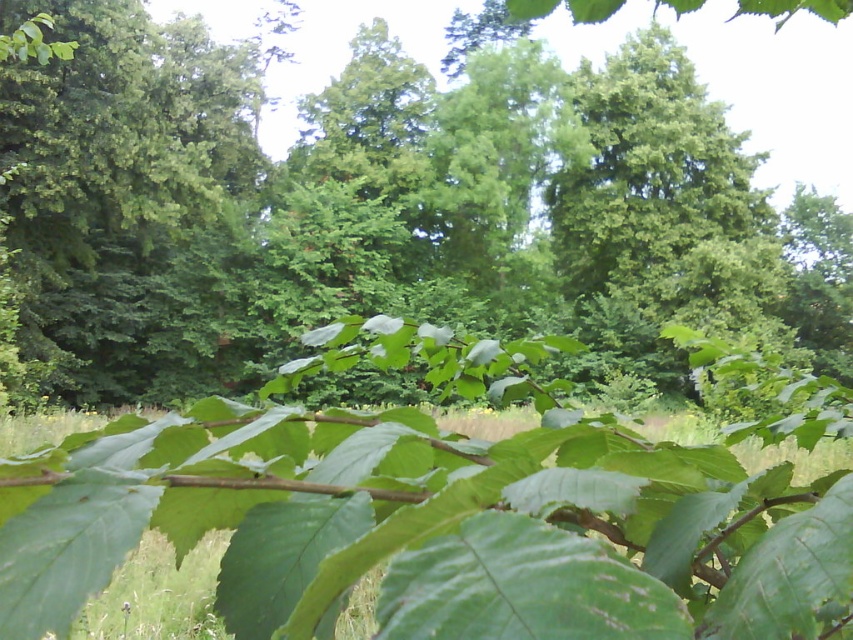
Which of these two, green leafy tree at upper center or green leafy grass at lower center, stands taller?

green leafy tree at upper center is taller.

Can you confirm if green leafy tree at upper center is thinner than green leafy grass at lower center?

Yes, green leafy tree at upper center is thinner than green leafy grass at lower center.

Between point (595, 260) and point (173, 573), which one is positioned in front?

Point (173, 573)

The width and height of the screenshot is (853, 640). What are the coordinates of `green leafy tree at upper center` in the screenshot? It's located at (664, 195).

Is point (195, 320) closer to camera compared to point (624, 109)?

Yes, it is.

Does green leafy branch at center appear over green leafy tree at upper center?

Indeed, green leafy branch at center is positioned over green leafy tree at upper center.

Describe the element at coordinates (378, 205) in the screenshot. This screenshot has height=640, width=853. I see `green leafy branch at center` at that location.

I want to click on green leafy branch at center, so click(378, 205).

Can you confirm if green leafy branch at center is wider than green leafy grass at lower center?

Yes, green leafy branch at center is wider than green leafy grass at lower center.

Is green leafy branch at center closer to the viewer compared to green leafy grass at lower center?

No.

Find the location of a particular element. This screenshot has height=640, width=853. green leafy branch at center is located at coordinates (378, 205).

Find the location of a particular element. green leafy branch at center is located at coordinates (378, 205).